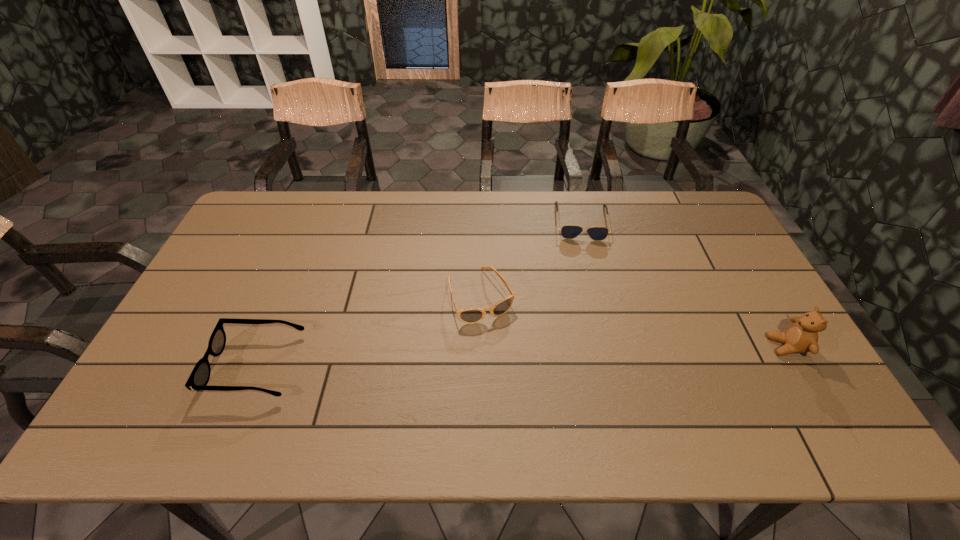
Locate an element on the screen. vacant area situated on the front-facing side of the rightmost object is located at coordinates (728, 346).

Where is `vacant space situated on the front-facing side of the rightmost object`? vacant space situated on the front-facing side of the rightmost object is located at coordinates (743, 346).

Where is `vacant region located on the front-facing side of the rightmost object`? The height and width of the screenshot is (540, 960). vacant region located on the front-facing side of the rightmost object is located at coordinates (633, 346).

Find the location of a particular element. vacant area located 0.140m on the front-facing side of the third nearest object is located at coordinates (512, 363).

The width and height of the screenshot is (960, 540). Find the location of `vacant position located on the front-facing side of the third nearest object`. vacant position located on the front-facing side of the third nearest object is located at coordinates (507, 354).

Find the location of a particular element. Image resolution: width=960 pixels, height=540 pixels. free space located 0.150m on the front-facing side of the third nearest object is located at coordinates (513, 367).

At what (x,y) coordinates should I click in order to perform the action: click on vacant position located 0.270m on the front-facing side of the farthest object. Please return your answer as a coordinate pair (x, y). The width and height of the screenshot is (960, 540). Looking at the image, I should click on (590, 303).

Identify the location of free space located on the front-facing side of the farthest object. This screenshot has width=960, height=540. (585, 255).

At what (x,y) coordinates should I click in order to perform the action: click on vacant space situated 0.330m on the front-facing side of the farthest object. Please return your answer as a coordinate pair (x, y). The width and height of the screenshot is (960, 540). Looking at the image, I should click on (591, 320).

The image size is (960, 540). Identify the location of object at the far edge. (568, 231).